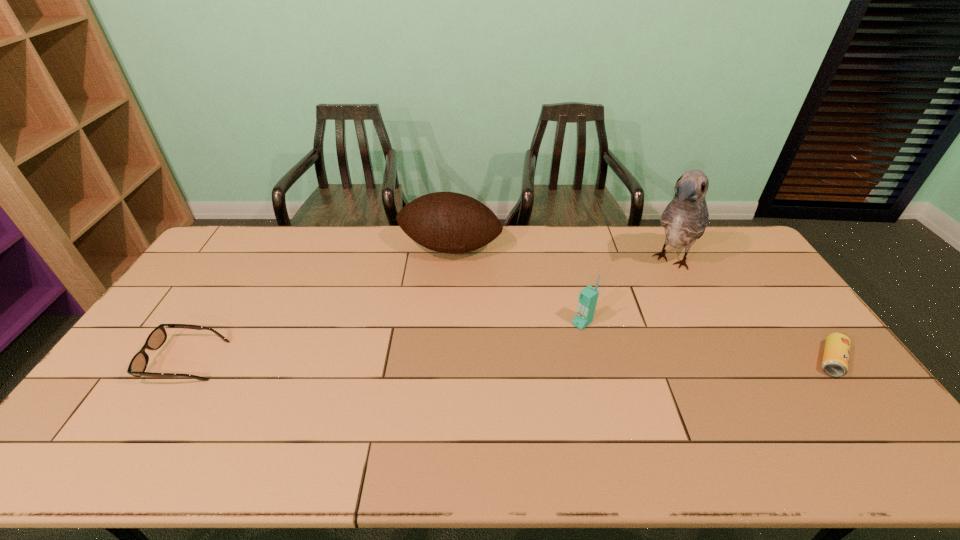
This screenshot has width=960, height=540. What are the coordinates of `object that is the fourth nearest to the third shortest object` in the screenshot? It's located at (138, 364).

What are the coordinates of `free space that satisfies the following two spatial constraints: 1. on the front side of the third farthest object; 2. on the right side of the football` in the screenshot? It's located at (444, 323).